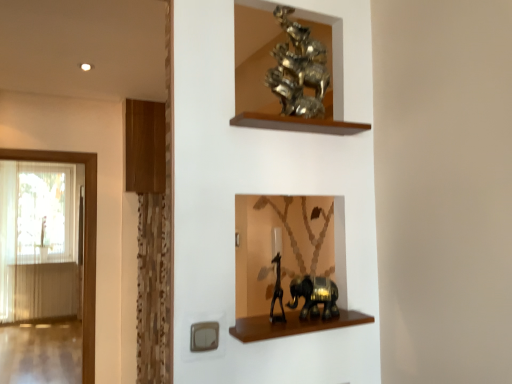
Question: Considering the relative sizes of brown wooden shelf at lower center, which appears as the 1th shelf when viewed from the right, and shiny black elephant at lower center, the first animal from the bottom, in the image provided, is brown wooden shelf at lower center, which appears as the 1th shelf when viewed from the right, bigger than shiny black elephant at lower center, the first animal from the bottom,?

Choices:
 (A) no
 (B) yes

Answer: (A)

Question: Is brown wooden shelf at lower center, which ranks as the second shelf in top-to-bottom order, looking in the opposite direction of shiny black elephant at lower center, arranged as the 3th animal when viewed from the top?

Choices:
 (A) yes
 (B) no

Answer: (B)

Question: Does brown wooden shelf at lower center, the first shelf positioned from the front, lie behind shiny black elephant at lower center, the first animal from the bottom?

Choices:
 (A) yes
 (B) no

Answer: (B)

Question: Is brown wooden shelf at lower center, the second shelf viewed from the back, not near shiny black elephant at lower center, arranged as the 3th animal when viewed from the top?

Choices:
 (A) no
 (B) yes

Answer: (A)

Question: From the image's perspective, is brown wooden shelf at lower center, which ranks as the second shelf in top-to-bottom order, on top of shiny black elephant at lower center, the first animal from the bottom?

Choices:
 (A) yes
 (B) no

Answer: (B)

Question: From a real-world perspective, is translucent glass door at left above or below gold metallic sculpture at upper center, arranged as the 1th animal when viewed from the top?

Choices:
 (A) above
 (B) below

Answer: (B)

Question: From the image's perspective, is translucent glass door at left above or below gold metallic sculpture at upper center, arranged as the 1th animal when viewed from the top?

Choices:
 (A) below
 (B) above

Answer: (A)

Question: From their relative heights in the image, would you say translucent glass door at left is taller or shorter than gold metallic sculpture at upper center, arranged as the 1th animal when viewed from the top?

Choices:
 (A) short
 (B) tall

Answer: (B)

Question: Is translucent glass door at left to the left or to the right of gold metallic sculpture at upper center, arranged as the 1th animal when viewed from the top, in the image?

Choices:
 (A) right
 (B) left

Answer: (B)

Question: In the image, is gold metallic sculpture at upper center, arranged as the 1th animal when viewed from the top, positioned in front of or behind metallic gold giraffe at lower center, the 2th animal in the top-to-bottom sequence?

Choices:
 (A) front
 (B) behind

Answer: (B)

Question: Considering the relative positions of gold metallic sculpture at upper center, placed as the third animal when sorted from bottom to top, and metallic gold giraffe at lower center, the 2th animal in the top-to-bottom sequence, in the image provided, is gold metallic sculpture at upper center, placed as the third animal when sorted from bottom to top, to the left or to the right of metallic gold giraffe at lower center, the 2th animal in the top-to-bottom sequence,?

Choices:
 (A) left
 (B) right

Answer: (B)

Question: Is gold metallic sculpture at upper center, placed as the third animal when sorted from bottom to top, inside or outside of metallic gold giraffe at lower center, which ranks as the 2th animal in bottom-to-top order?

Choices:
 (A) inside
 (B) outside

Answer: (B)

Question: From the image's perspective, relative to metallic gold giraffe at lower center, the 2th animal in the top-to-bottom sequence, is gold metallic sculpture at upper center, arranged as the 1th animal when viewed from the top, above or below?

Choices:
 (A) below
 (B) above

Answer: (B)

Question: Relative to gold metallic sculpture at upper center, arranged as the 1th animal when viewed from the top, is wooden at left, marked as the second shelf in a bottom-to-top arrangement, in front or behind?

Choices:
 (A) behind
 (B) front

Answer: (A)

Question: Is wooden at left, the 1th shelf in the top-to-bottom sequence, to the left or to the right of gold metallic sculpture at upper center, arranged as the 1th animal when viewed from the top, in the image?

Choices:
 (A) right
 (B) left

Answer: (B)